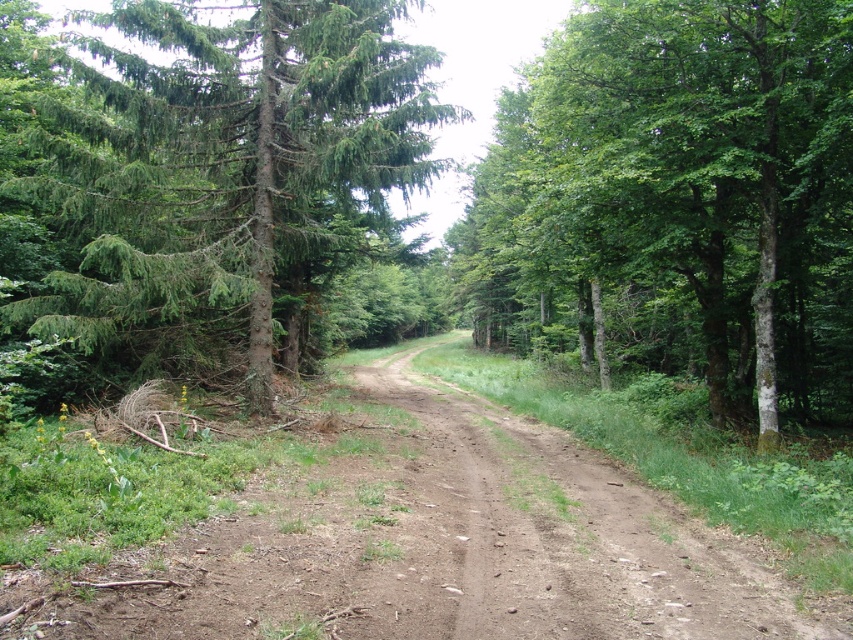
Question: Which object is closer to the camera taking this photo?

Choices:
 (A) green matte tree at upper left
 (B) green leafy tree at center

Answer: (B)

Question: Does green leafy tree at center have a lesser width compared to green matte tree at upper left?

Choices:
 (A) no
 (B) yes

Answer: (B)

Question: Can you confirm if green leafy tree at center is bigger than green matte tree at upper left?

Choices:
 (A) yes
 (B) no

Answer: (B)

Question: In this image, where is green leafy tree at center located relative to green matte tree at upper left?

Choices:
 (A) left
 (B) right

Answer: (B)

Question: Which point is farther to the camera?

Choices:
 (A) (279, 253)
 (B) (627, 10)

Answer: (A)